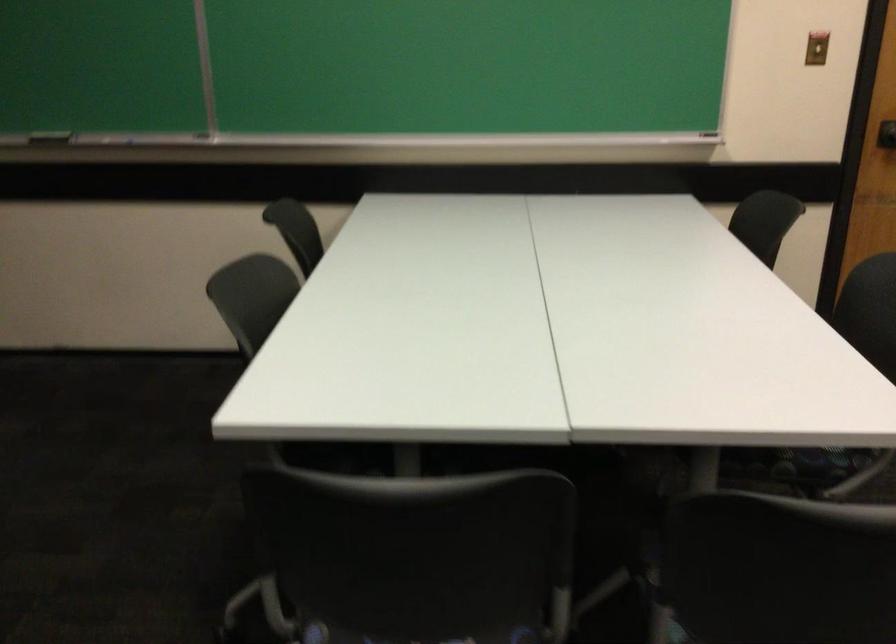
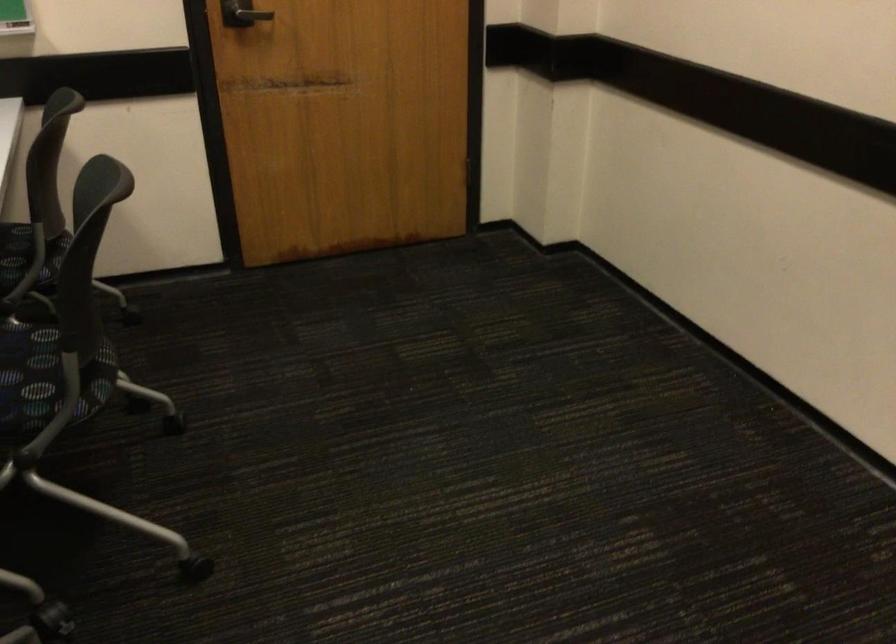
Question: The camera is either moving clockwise (left) or counter-clockwise (right) around the object. The first image is from the beginning of the video and the second image is from the end. Is the camera moving left or right when shooting the video?

Choices:
 (A) Left
 (B) Right

Answer: (A)